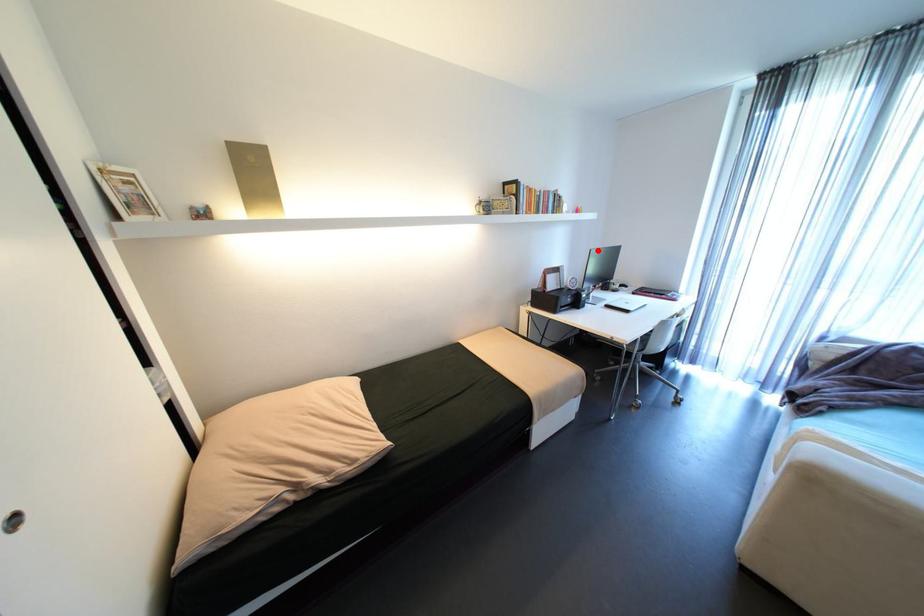
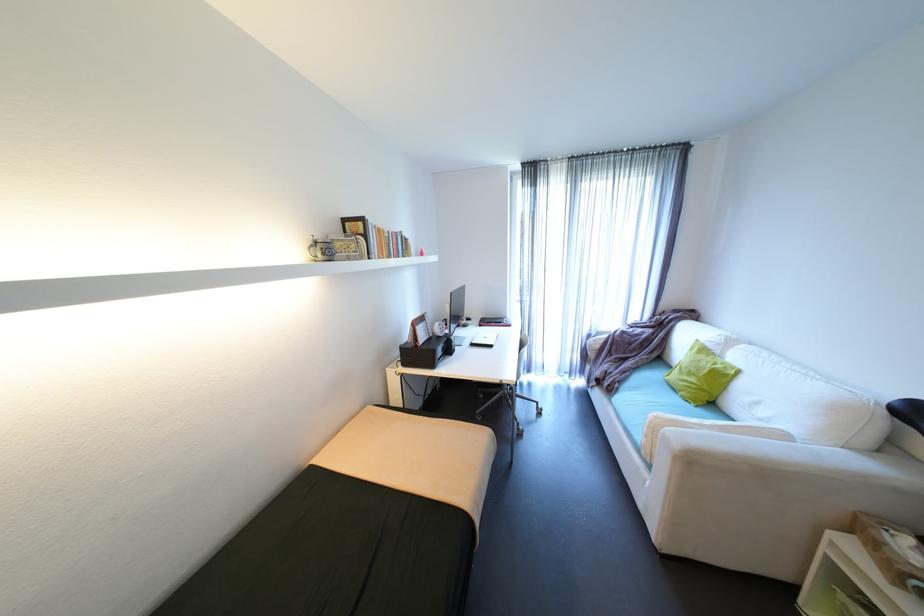
Question: I am providing you with two images of the same scene from different viewpoints. Image1 has a red point marked. In image2, the corresponding 3D location appears at what relative position? Reply with the corresponding letter.

Choices:
 (A) Closer
 (B) Farther

Answer: (B)